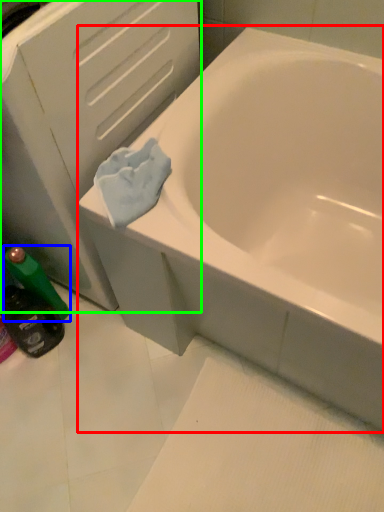
Question: Which object is the closest to the bathtub (highlighted by a red box)? Choose among these: mouthwash (highlighted by a blue box) or file cabinet (highlighted by a green box).

Choices:
 (A) mouthwash
 (B) file cabinet

Answer: (B)